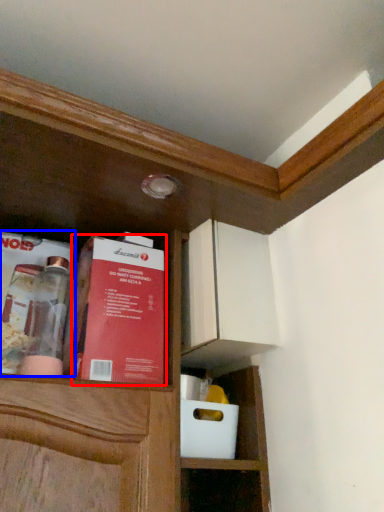
Question: Which object is closer to the camera taking this photo, book (highlighted by a red box) or book (highlighted by a blue box)?

Choices:
 (A) book
 (B) book

Answer: (A)